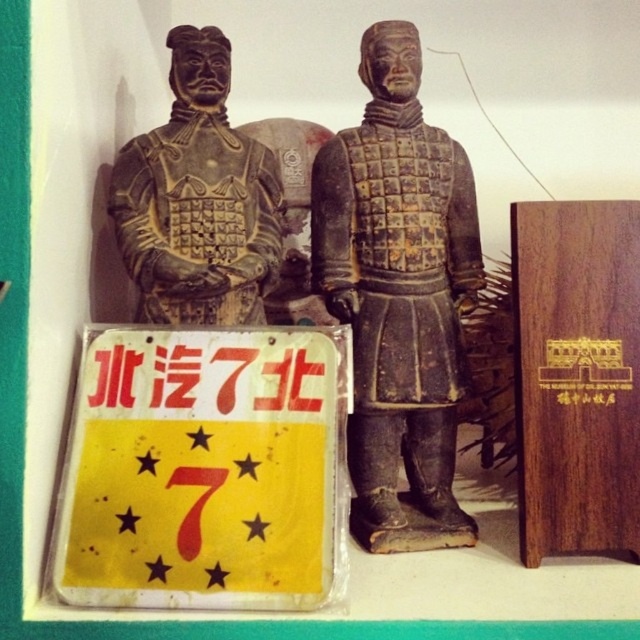
Question: Can you confirm if brown matte armor at center is bigger than matte black armor at left?

Choices:
 (A) yes
 (B) no

Answer: (A)

Question: Which object appears closest to the camera in this image?

Choices:
 (A) yellow plastic sign at lower left
 (B) brown matte armor at center
 (C) matte black armor at left

Answer: (A)

Question: Which point is farther to the camera?

Choices:
 (A) [x=413, y=288]
 (B) [x=109, y=448]

Answer: (A)

Question: Is brown matte armor at center in front of matte black armor at left?

Choices:
 (A) no
 (B) yes

Answer: (B)

Question: Among these points, which one is nearest to the camera?

Choices:
 (A) (435, 140)
 (B) (204, 538)
 (C) (186, 140)

Answer: (B)

Question: Observing the image, what is the correct spatial positioning of yellow plastic sign at lower left in reference to brown matte armor at center?

Choices:
 (A) right
 (B) left

Answer: (B)